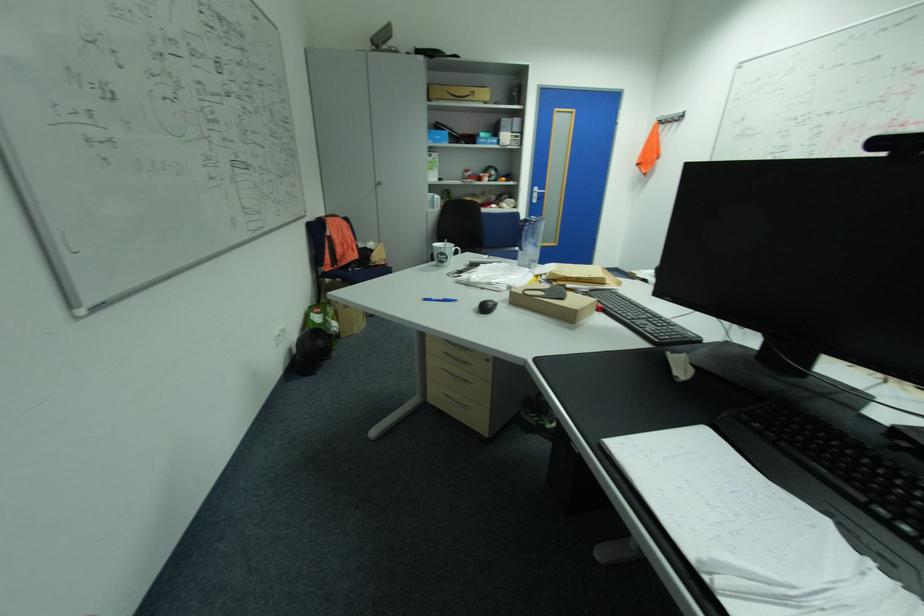
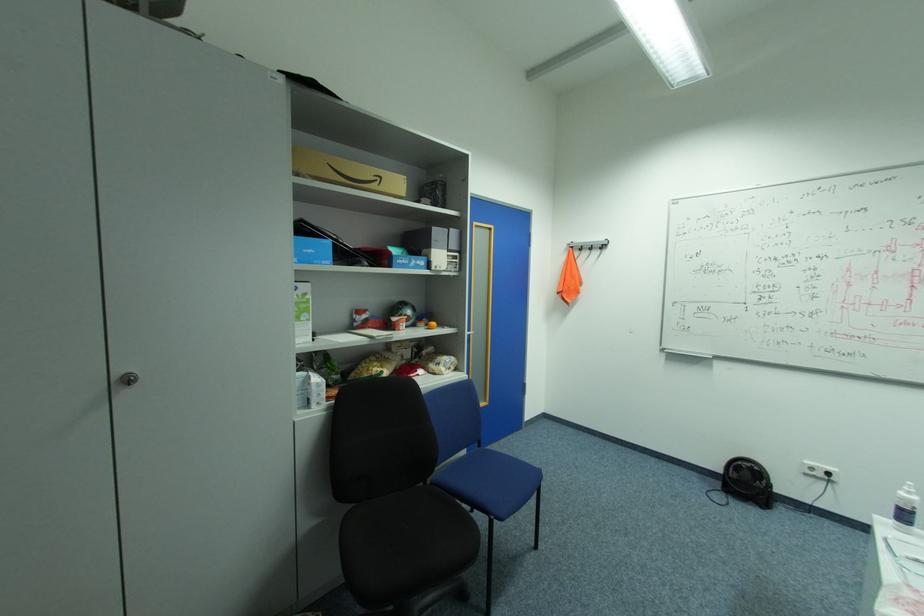
Where in the second image is the point corresponding to pixel 442 200 from the first image?

(321, 387)